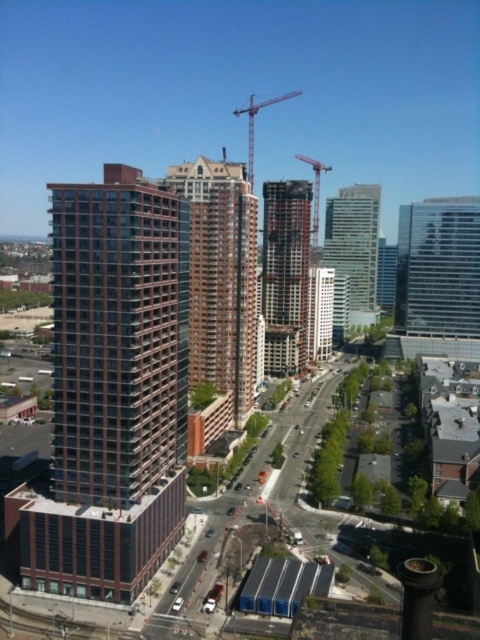
Between matte glass building at center and metallic construction crane at center, which one has more height?

metallic construction crane at center

Can you confirm if matte glass building at center is shorter than metallic construction crane at center?

Indeed, matte glass building at center has a lesser height compared to metallic construction crane at center.

Locate an element on the screen. The image size is (480, 640). matte glass building at center is located at coordinates (320, 312).

Where is `matte glass building at center`? The width and height of the screenshot is (480, 640). matte glass building at center is located at coordinates (320, 312).

Is transparent glass skyscraper at right thinner than dark brown concrete building at center?

No.

Does transparent glass skyscraper at right appear on the right side of dark brown concrete building at center?

Correct, you'll find transparent glass skyscraper at right to the right of dark brown concrete building at center.

Which is behind, point (468, 323) or point (294, 284)?

The point (468, 323) is behind.

In order to click on transparent glass skyscraper at right in this screenshot , I will do `click(439, 268)`.

Who is shorter, matte glass building at center or metallic gray crane at upper center?

matte glass building at center is shorter.

Consider the image. Can you confirm if matte glass building at center is positioned above metallic gray crane at upper center?

No.

The width and height of the screenshot is (480, 640). I want to click on matte glass building at center, so (x=320, y=312).

Identify the location of matte glass building at center. (320, 312).